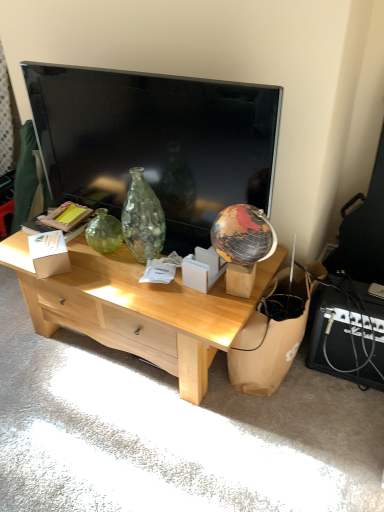
Question: Is the depth of light wood desk at center less than that of white cardboard box at center, which is the first cardboard box from left to right?

Choices:
 (A) no
 (B) yes

Answer: (B)

Question: Are light wood desk at center and white cardboard box at center, which is the first cardboard box from left to right, making contact?

Choices:
 (A) no
 (B) yes

Answer: (A)

Question: Is light wood desk at center shorter than white cardboard box at center, marked as the 2th cardboard box in a right-to-left arrangement?

Choices:
 (A) yes
 (B) no

Answer: (B)

Question: Is light wood desk at center at the right side of white cardboard box at center, marked as the 2th cardboard box in a right-to-left arrangement?

Choices:
 (A) yes
 (B) no

Answer: (A)

Question: Could you tell me if light wood desk at center is turned towards white cardboard box at center, marked as the 2th cardboard box in a right-to-left arrangement?

Choices:
 (A) no
 (B) yes

Answer: (A)

Question: Looking at their shapes, would you say white cardboard box at center, the first cardboard box in the right-to-left sequence, is wider or thinner than light wood desk at center?

Choices:
 (A) thin
 (B) wide

Answer: (A)

Question: Is white cardboard box at center, the first cardboard box in the right-to-left sequence, spatially inside light wood desk at center, or outside of it?

Choices:
 (A) inside
 (B) outside

Answer: (B)

Question: Visually, is white cardboard box at center, which is the 2th cardboard box in left-to-right order, positioned to the left or to the right of light wood desk at center?

Choices:
 (A) right
 (B) left

Answer: (A)

Question: From the image's perspective, is white cardboard box at center, which is the 2th cardboard box in left-to-right order, positioned above or below light wood desk at center?

Choices:
 (A) above
 (B) below

Answer: (A)

Question: Choose the correct answer: Is light wood desk at center inside white cardboard box at center, marked as the 2th cardboard box in a right-to-left arrangement, or outside it?

Choices:
 (A) inside
 (B) outside

Answer: (B)

Question: In the image, is light wood desk at center on the left side or the right side of white cardboard box at center, which is the first cardboard box from left to right?

Choices:
 (A) left
 (B) right

Answer: (B)

Question: From a real-world perspective, is light wood desk at center physically located above or below white cardboard box at center, marked as the 2th cardboard box in a right-to-left arrangement?

Choices:
 (A) above
 (B) below

Answer: (B)

Question: In terms of width, does light wood desk at center look wider or thinner when compared to white cardboard box at center, which is the first cardboard box from left to right?

Choices:
 (A) thin
 (B) wide

Answer: (B)

Question: From a real-world perspective, is brown paper bag at lower right positioned above or below white cardboard box at center, which is the 2th cardboard box in left-to-right order?

Choices:
 (A) above
 (B) below

Answer: (B)

Question: In terms of width, does brown paper bag at lower right look wider or thinner when compared to white cardboard box at center, which is the 2th cardboard box in left-to-right order?

Choices:
 (A) wide
 (B) thin

Answer: (A)